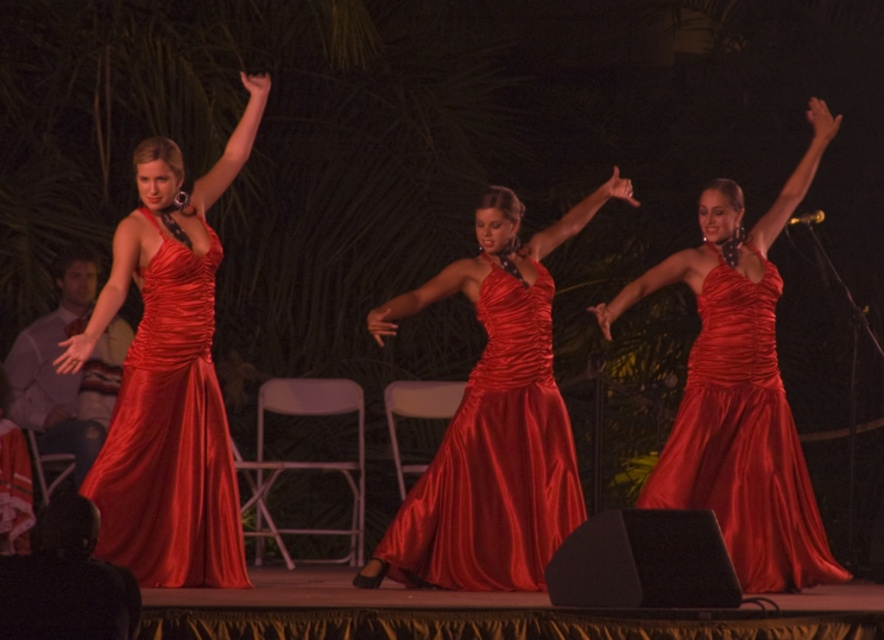
Can you confirm if satin dress at left is taller than shiny satin dress at center?

Yes, satin dress at left is taller than shiny satin dress at center.

Which of these two, satin dress at left or shiny satin dress at center, stands shorter?

Standing shorter between the two is shiny satin dress at center.

Who is more forward, (166, 262) or (721, 369)?

Point (166, 262) is more forward.

You are a GUI agent. You are given a task and a screenshot of the screen. Output one action in this format:
    pyautogui.click(x=<x>, y=<y>)
    Task: Click on the satin dress at left
    Image resolution: width=884 pixels, height=640 pixels.
    Given the screenshot: What is the action you would take?
    pyautogui.click(x=170, y=436)

Can you confirm if satin dress at center is shorter than satin dress at left?

Yes, satin dress at center is shorter than satin dress at left.

Does satin dress at center appear on the right side of satin dress at left?

Yes, satin dress at center is to the right of satin dress at left.

Measure the distance between point (463, 490) and camera.

They are 24.14 feet apart.

Locate an element on the screen. satin dress at center is located at coordinates (494, 460).

Looking at this image, who is more forward, (439, 481) or (742, 298)?

Positioned in front is point (439, 481).

Where is `satin dress at center`? The height and width of the screenshot is (640, 884). satin dress at center is located at coordinates (494, 460).

Find the location of a particular element. Image resolution: width=884 pixels, height=640 pixels. satin dress at center is located at coordinates (494, 460).